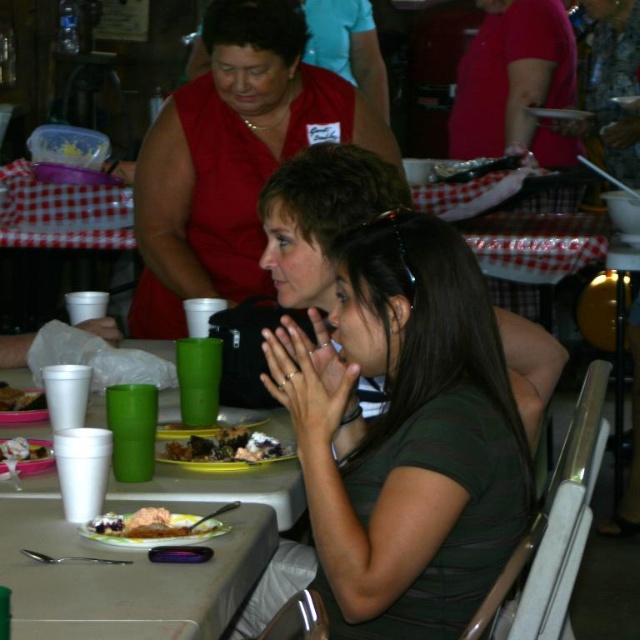
Is matte green cup at upper center to the left of brown matte food at center from the viewer's perspective?

Indeed, matte green cup at upper center is positioned on the left side of brown matte food at center.

Is point (230, 186) closer to camera compared to point (225, 432)?

No, (230, 186) is further to viewer.

This screenshot has height=640, width=640. I want to click on matte green cup at upper center, so point(230,157).

Can you confirm if matte green cup at upper center is taller than white styrofoam cups at lower left?

Correct, matte green cup at upper center is much taller as white styrofoam cups at lower left.

Identify the location of matte green cup at upper center. (230, 157).

Between green matte shirt at center and dark green fabric shirt at center, which one is positioned lower?

Positioned lower is green matte shirt at center.

Does green matte shirt at center have a greater width compared to dark green fabric shirt at center?

Indeed, green matte shirt at center has a greater width compared to dark green fabric shirt at center.

Consider the image. Who is more distant from viewer, (321, 497) or (285, 211)?

Positioned behind is point (285, 211).

The height and width of the screenshot is (640, 640). Identify the location of green matte shirt at center. (401, 440).